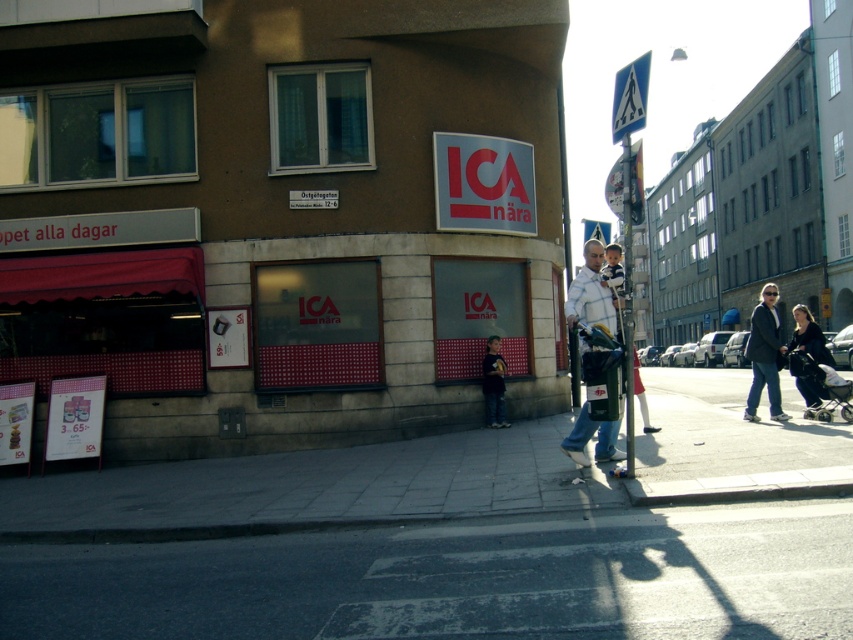
Question: Which of the following is the closest to the observer?

Choices:
 (A) dark gray suit at right
 (B) concrete sidewalk at lower center

Answer: (B)

Question: Does asphalt at lower center appear under concrete sidewalk at lower center?

Choices:
 (A) no
 (B) yes

Answer: (A)

Question: Among these objects, which one is farthest from the camera?

Choices:
 (A) metallic pole at center
 (B) concrete sidewalk at lower center
 (C) dark blue jeans at lower right
 (D) denim pants at center

Answer: (D)

Question: Is asphalt at lower center smaller than dark gray suit at right?

Choices:
 (A) no
 (B) yes

Answer: (B)

Question: Is concrete sidewalk at lower center in front of white striped shirt at center?

Choices:
 (A) no
 (B) yes

Answer: (B)

Question: Which point is farther to the camera?

Choices:
 (A) (500, 560)
 (B) (734, 413)

Answer: (B)